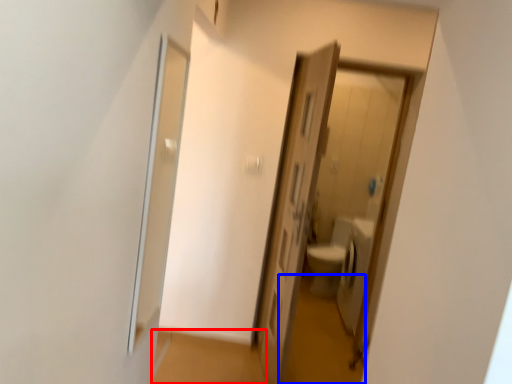
Question: Which object appears closest to the camera in this image, path (highlighted by a red box) or path (highlighted by a blue box)?

Choices:
 (A) path
 (B) path

Answer: (A)